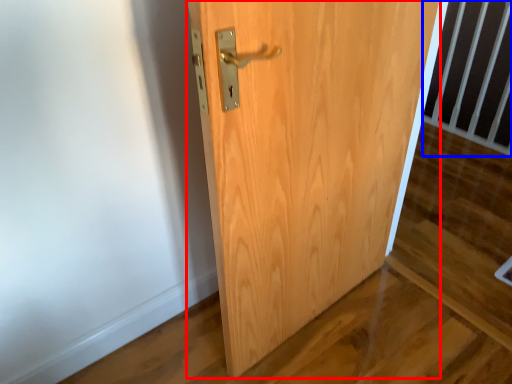
Question: Which object appears farthest to the camera in this image, door (highlighted by a red box) or balustrade (highlighted by a blue box)?

Choices:
 (A) door
 (B) balustrade

Answer: (B)